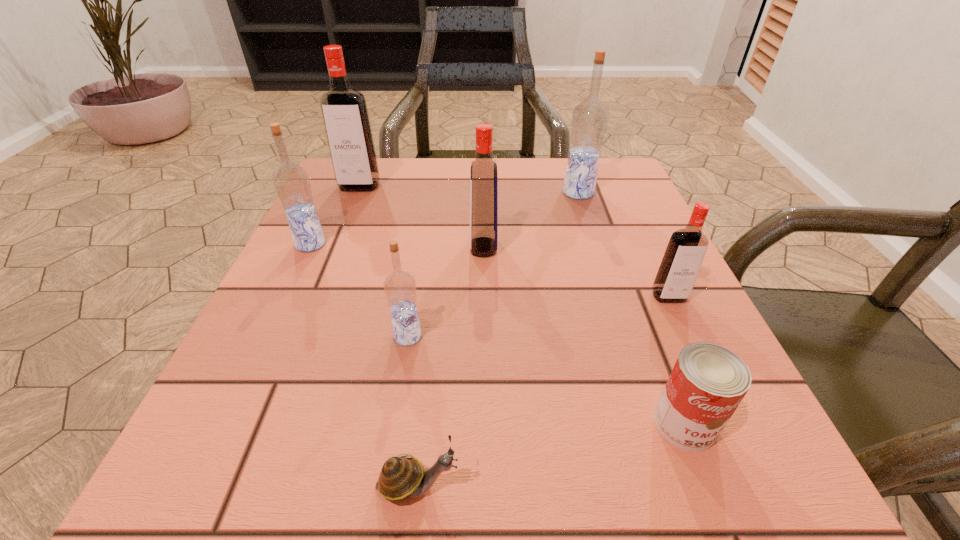
At what (x,y) coordinates should I click in order to perform the action: click on the nearest vodka. Please return your answer as a coordinate pair (x, y). The width and height of the screenshot is (960, 540). Looking at the image, I should click on (399, 286).

The height and width of the screenshot is (540, 960). I want to click on the nearest blue vodka, so click(x=399, y=286).

The height and width of the screenshot is (540, 960). In order to click on the second nearest object in this screenshot , I will do `click(708, 382)`.

The image size is (960, 540). I want to click on can, so click(708, 382).

Where is `gray snail`? The width and height of the screenshot is (960, 540). gray snail is located at coordinates (400, 478).

Locate an element on the screen. snail is located at coordinates (400, 478).

Locate an element on the screen. Image resolution: width=960 pixels, height=540 pixels. free spot located on the back of the rightmost blue vodka is located at coordinates (569, 166).

Identify the location of vacant point located 0.090m on the front and back of the leftmost red vodka. The width and height of the screenshot is (960, 540). (348, 215).

Find the location of a particular element. The width and height of the screenshot is (960, 540). vacant region located 0.070m on the front and back of the second biggest red vodka is located at coordinates (434, 247).

What are the coordinates of `free region located 0.320m on the front and back of the second biggest red vodka` in the screenshot? It's located at (304, 247).